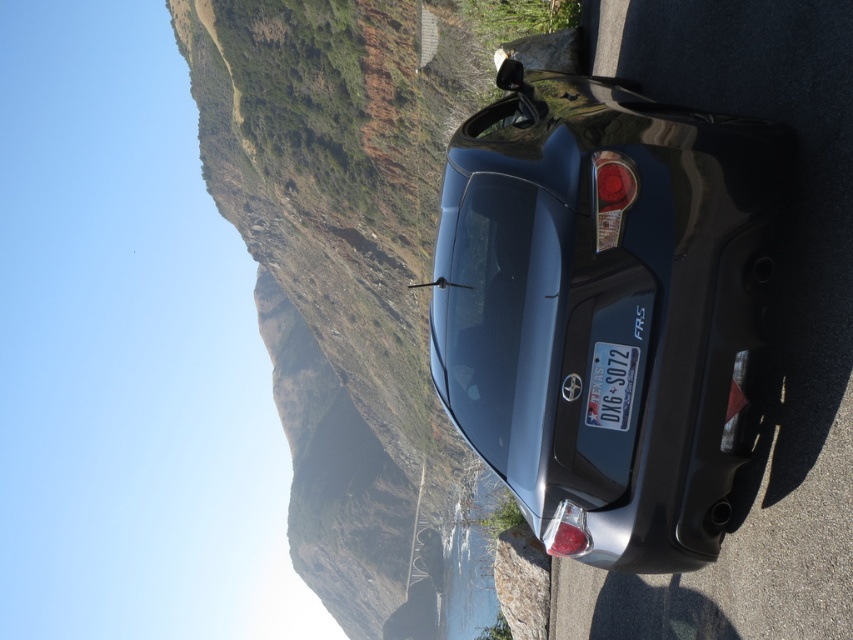
Question: Does satin black car at center have a smaller size compared to metallic blue license plate at center?

Choices:
 (A) yes
 (B) no

Answer: (B)

Question: Which of the following is the closest to the observer?

Choices:
 (A) metallic blue license plate at center
 (B) satin black car at center

Answer: (B)

Question: Among these objects, which one is farthest from the camera?

Choices:
 (A) metallic blue license plate at center
 (B) satin black car at center

Answer: (A)

Question: Among these points, which one is nearest to the camera?

Choices:
 (A) (560, 440)
 (B) (633, 392)

Answer: (B)

Question: From the image, what is the correct spatial relationship of satin black car at center in relation to metallic blue license plate at center?

Choices:
 (A) left
 (B) right

Answer: (A)

Question: Is satin black car at center below metallic blue license plate at center?

Choices:
 (A) yes
 (B) no

Answer: (B)